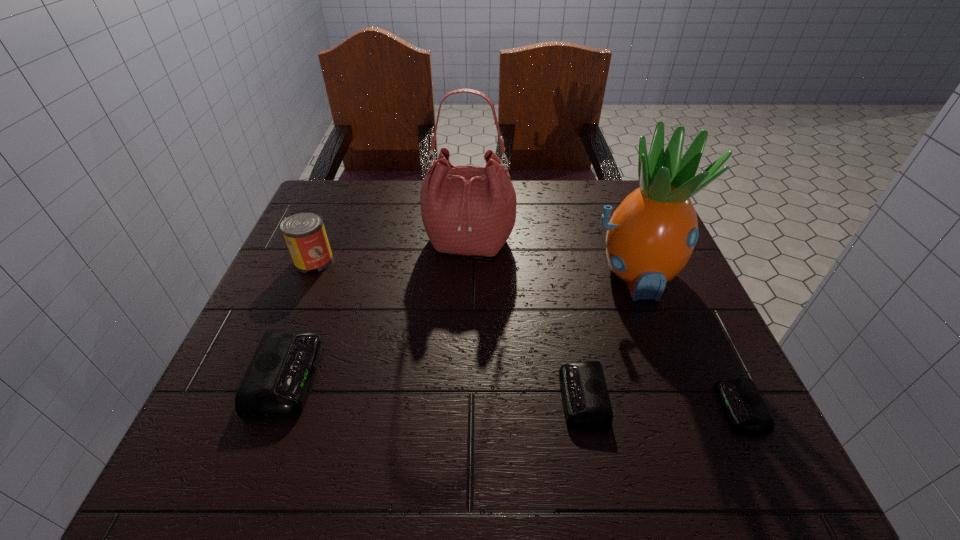
This screenshot has height=540, width=960. Find the location of `vacant space at the far left corner of the desktop`. vacant space at the far left corner of the desktop is located at coordinates (338, 196).

Where is `free space at the near left corner of the desktop`? This screenshot has height=540, width=960. free space at the near left corner of the desktop is located at coordinates (214, 413).

At what (x,y) coordinates should I click in order to perform the action: click on free region at the near right corner. Please return your answer as a coordinate pair (x, y). The width and height of the screenshot is (960, 540). Looking at the image, I should click on (682, 404).

You are a GUI agent. You are given a task and a screenshot of the screen. Output one action in this format:
    pyautogui.click(x=<x>, y=<y>)
    Task: Click on the free space between the third tallest object and the shortest object
    
    Given the screenshot: What is the action you would take?
    pyautogui.click(x=527, y=334)

Where is `free spot between the third tallest object and the pineapple`? free spot between the third tallest object and the pineapple is located at coordinates (474, 268).

Identify the location of vacant space that is in between the second shortest object and the handbag. The height and width of the screenshot is (540, 960). (526, 319).

Locate an element on the screen. This screenshot has height=540, width=960. empty space between the third shortest object and the shortest alarm clock is located at coordinates (514, 392).

Locate an element on the screen. free space that is in between the pineapple and the third tallest object is located at coordinates (474, 268).

The height and width of the screenshot is (540, 960). I want to click on vacant space that's between the shortest object and the pineapple, so click(x=687, y=341).

I want to click on blank region between the pineapple and the can, so click(x=474, y=268).